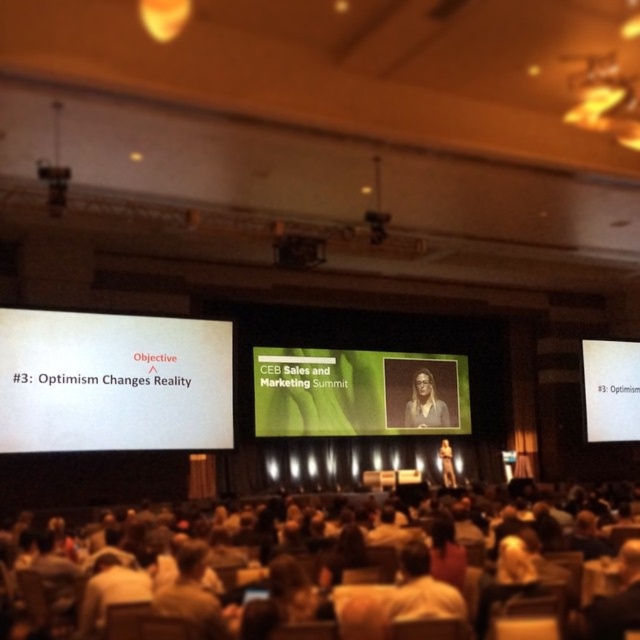
Question: Which point is farther from the camera taking this photo?

Choices:
 (A) (445, 470)
 (B) (81, 355)
 (C) (435, 420)

Answer: (C)

Question: Which object is closer to the camera taking this photo?

Choices:
 (A) green matte projection screen at center
 (B) white paper at center
 (C) matte black suit at center

Answer: (A)

Question: Observing the image, what is the correct spatial positioning of white matte projector screen at left in reference to white paper at center?

Choices:
 (A) left
 (B) right

Answer: (A)

Question: Is white matte projector screen at left bigger than matte black suit at center?

Choices:
 (A) yes
 (B) no

Answer: (A)

Question: Which of the following is the farthest from the observer?

Choices:
 (A) (106, 346)
 (B) (371, 388)

Answer: (B)

Question: Does blonde hair at center appear under matte black suit at center?

Choices:
 (A) yes
 (B) no

Answer: (B)